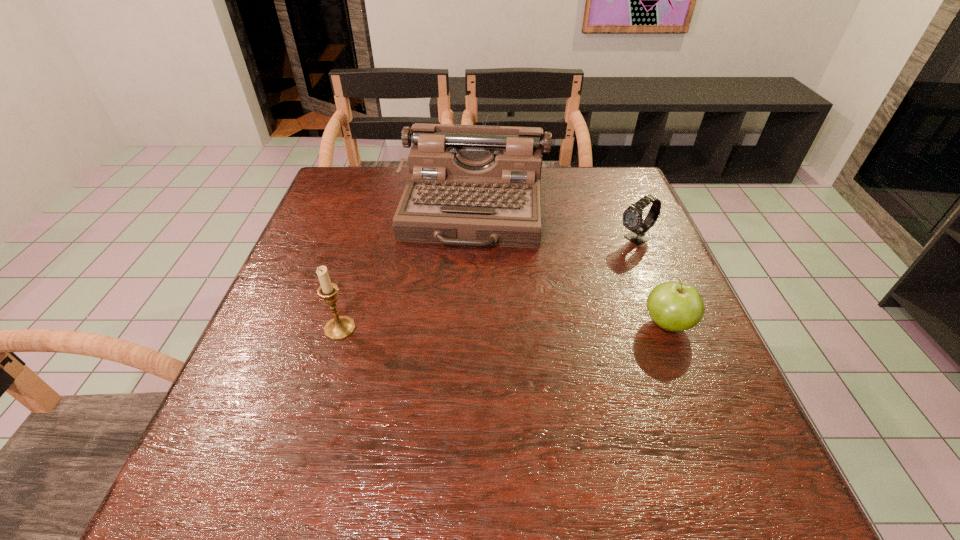
The image size is (960, 540). I want to click on free point between the third shortest object and the watch, so click(x=489, y=284).

Identify the location of vacant area that lies between the third shortest object and the apple. (504, 326).

Identify the location of free space between the watch and the third shortest object. This screenshot has height=540, width=960. (489, 284).

Identify which object is the nearest to the candle holder. Please provide its 2D coordinates. Your answer should be formatted as a tuple, i.e. [(x, y)], where the tuple contains the x and y coordinates of a point satisfying the conditions above.

[(473, 185)]

Choose which object is the second nearest neighbor to the leftmost object. Please provide its 2D coordinates. Your answer should be formatted as a tuple, i.e. [(x, y)], where the tuple contains the x and y coordinates of a point satisfying the conditions above.

[(674, 306)]

Image resolution: width=960 pixels, height=540 pixels. I want to click on vacant space that satisfies the following two spatial constraints: 1. on the back side of the watch; 2. on the left side of the candle holder, so click(x=367, y=239).